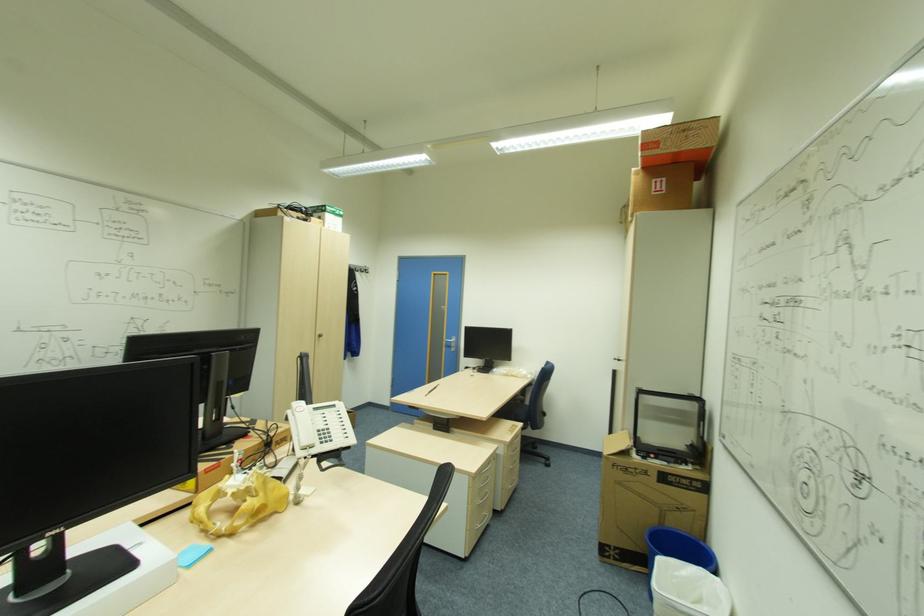
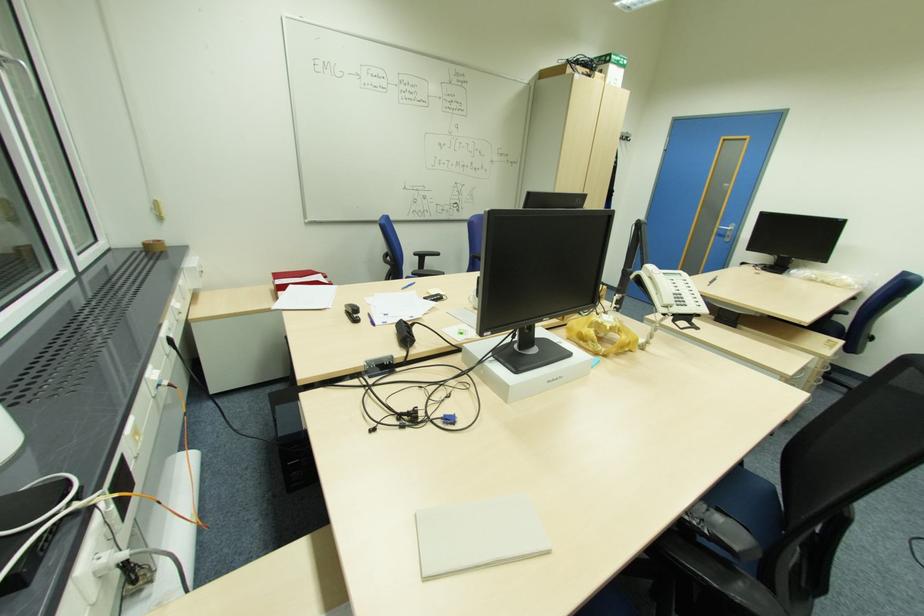
The point at (456,346) is marked in the first image. Where is the corresponding point in the second image?

(732, 236)